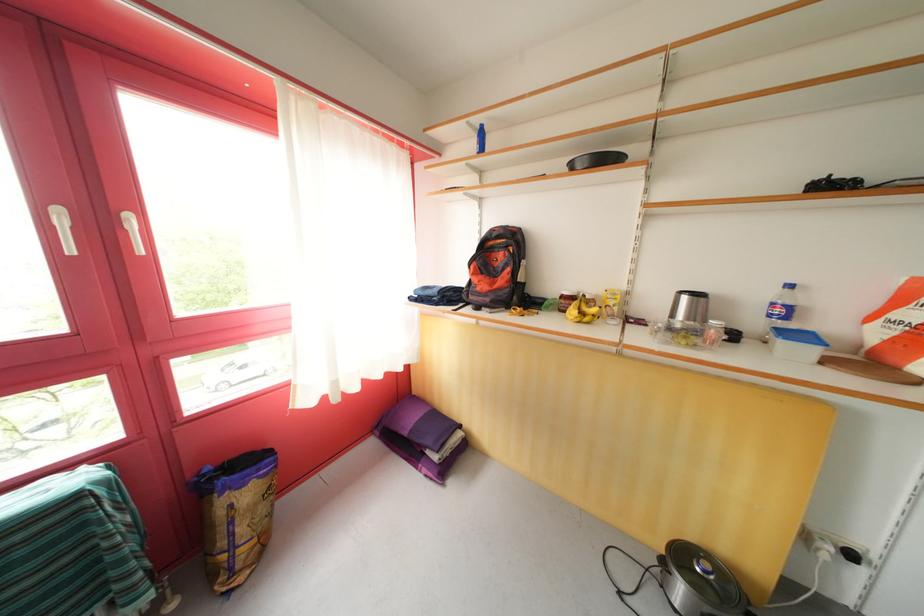
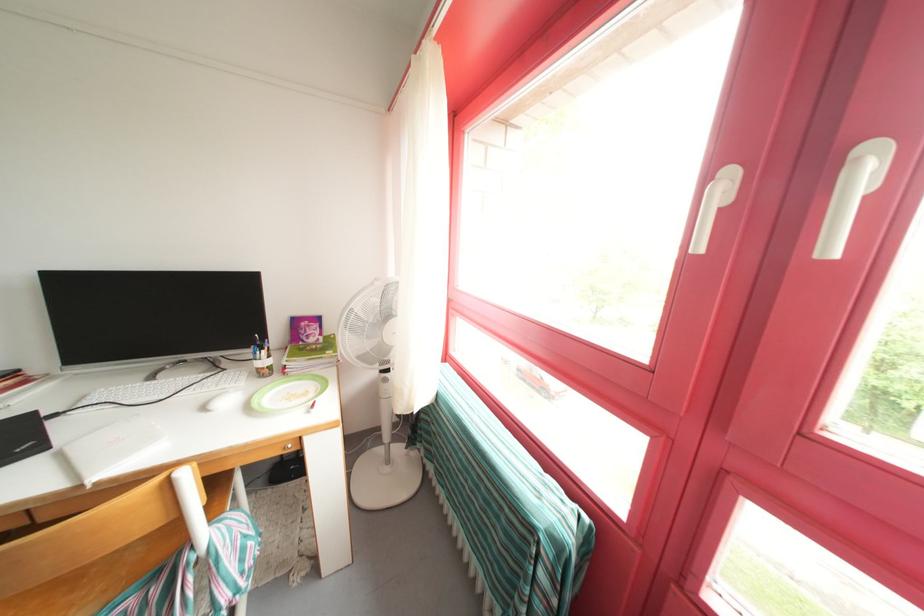
Based on the continuous images, in which direction is the camera rotating?

The camera rotated toward left-down.